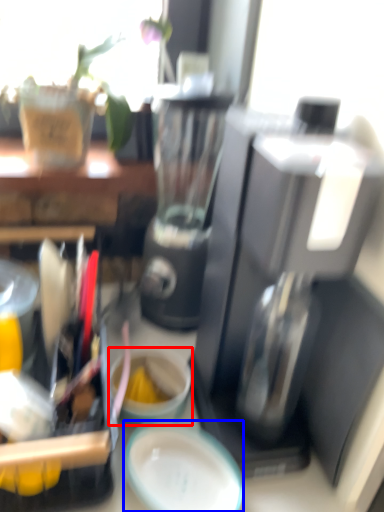
Question: Which object appears farthest to the camera in this image, coffee cup (highlighted by a red box) or plate (highlighted by a blue box)?

Choices:
 (A) coffee cup
 (B) plate

Answer: (A)